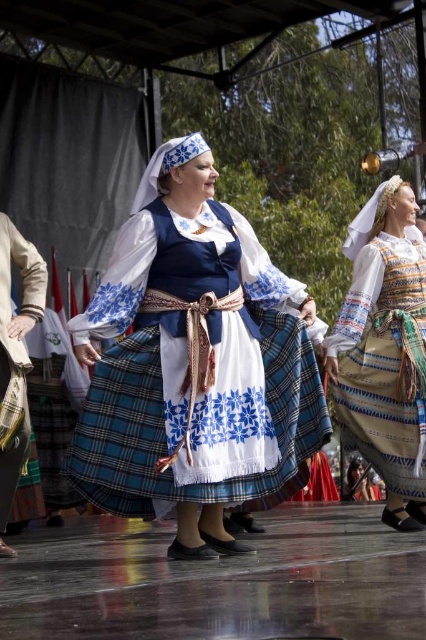
Question: Does blue plaid skirt at center appear over embroidered fabric dress at center?

Choices:
 (A) no
 (B) yes

Answer: (B)

Question: Which of these objects is positioned closest to the blue plaid skirt at center?

Choices:
 (A) embroidered fabric dress at center
 (B) plaid fabric skirt at center

Answer: (B)

Question: Which point is farther to the camera?

Choices:
 (A) plaid fabric skirt at center
 (B) blue plaid skirt at center

Answer: (A)

Question: Is blue plaid skirt at center wider than embroidered fabric dress at center?

Choices:
 (A) yes
 (B) no

Answer: (A)

Question: Among these objects, which one is farthest from the camera?

Choices:
 (A) blue plaid skirt at center
 (B) plaid fabric skirt at center

Answer: (B)

Question: Does blue plaid skirt at center have a greater width compared to embroidered fabric dress at center?

Choices:
 (A) no
 (B) yes

Answer: (B)